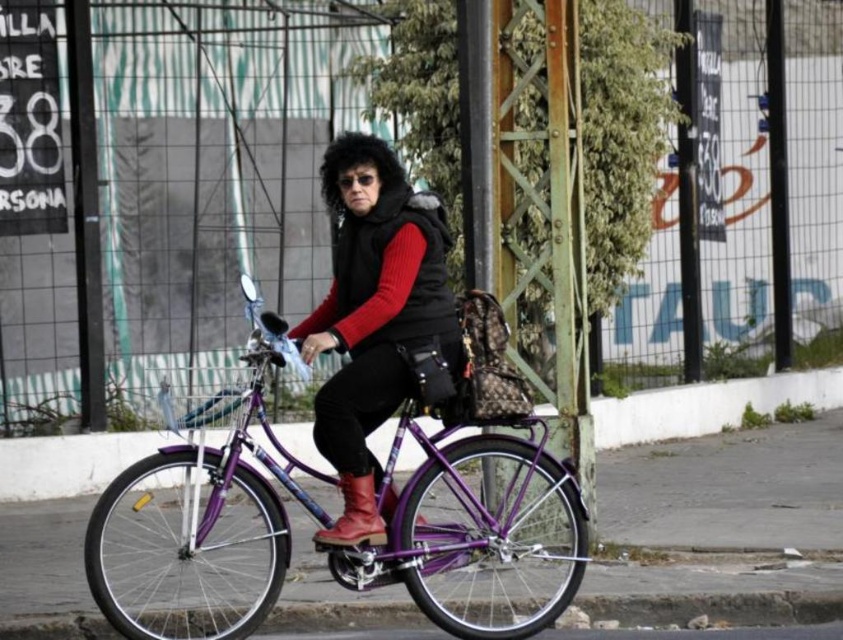
The person is wearing a matte black vest at center and a leather boot at center. Which item is positioned higher on the body?

The matte black vest at center is taller than the leather boot at center, so the vest is positioned higher on the body.

You are standing on the sidewalk and see two points marked on the ground ahead of you. The first point is at coordinate point (345, 365) and the second is at coordinate point (353, 500). Which point is closer to you?

Point (345, 365) is closer to you because it is further to the viewer than point (353, 500).

Based on the coordinates provided in the image, where is the purple metallic bicycle at center located?

The purple metallic bicycle at center is located at point 2D coordinates of (200, 516).